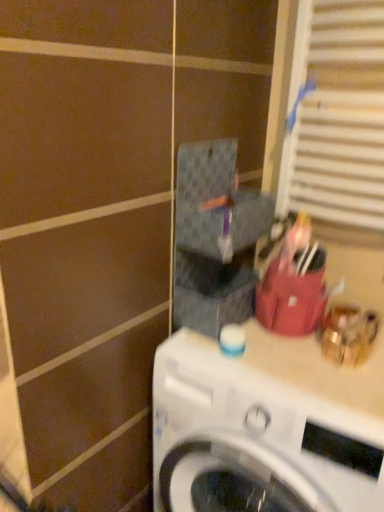
This screenshot has height=512, width=384. What do you see at coordinates (266, 426) in the screenshot?
I see `white glossy washing machine at center` at bounding box center [266, 426].

The width and height of the screenshot is (384, 512). Identify the location of white glossy washing machine at center. (266, 426).

Locate an element on the screen. white textured blinds at upper right is located at coordinates (337, 115).

What do you see at coordinates (337, 115) in the screenshot?
I see `white textured blinds at upper right` at bounding box center [337, 115].

Locate an element on the screen. The width and height of the screenshot is (384, 512). white glossy washing machine at center is located at coordinates (266, 426).

Between white textured blinds at upper right and white glossy washing machine at center, which one appears on the left side from the viewer's perspective?

Positioned to the left is white glossy washing machine at center.

Considering the positions of objects white textured blinds at upper right and white glossy washing machine at center in the image provided, who is in front, white textured blinds at upper right or white glossy washing machine at center?

white glossy washing machine at center is in front.

Which is less distant, (345, 52) or (301, 509)?

Positioned in front is point (301, 509).

From the image's perspective, which one is positioned lower, white textured blinds at upper right or white glossy washing machine at center?

From the image's view, white glossy washing machine at center is below.

From a real-world perspective, is white textured blinds at upper right above or below white glossy washing machine at center?

In terms of real-world spatial position, white textured blinds at upper right is above white glossy washing machine at center.

Which object is wider, white textured blinds at upper right or white glossy washing machine at center?

white glossy washing machine at center.

Considering the sizes of white textured blinds at upper right and white glossy washing machine at center in the image, is white textured blinds at upper right taller or shorter than white glossy washing machine at center?

white textured blinds at upper right is shorter than white glossy washing machine at center.

Between white textured blinds at upper right and white glossy washing machine at center, which one has larger size?

With larger size is white glossy washing machine at center.

Is white textured blinds at upper right situated inside white glossy washing machine at center or outside?

white textured blinds at upper right is located beyond the bounds of white glossy washing machine at center.

Is white textured blinds at upper right far from white glossy washing machine at center?

No, white textured blinds at upper right is not far away from white glossy washing machine at center.

Is white textured blinds at upper right facing towards white glossy washing machine at center?

No, white textured blinds at upper right is not aimed at white glossy washing machine at center.

Can you tell me how much white textured blinds at upper right and white glossy washing machine at center differ in facing direction?

There is a 0.0314-degree angle between the facing directions of white textured blinds at upper right and white glossy washing machine at center.

Measure the distance from white textured blinds at upper right to white glossy washing machine at center.

The distance of white textured blinds at upper right from white glossy washing machine at center is 59.33 centimeters.

Where is `washing machine lying on the left of white textured blinds at upper right`? This screenshot has height=512, width=384. washing machine lying on the left of white textured blinds at upper right is located at coordinates (266, 426).

Considering the relative positions of white glossy washing machine at center and white textured blinds at upper right in the image provided, is white glossy washing machine at center to the right of white textured blinds at upper right from the viewer's perspective?

No, white glossy washing machine at center is not to the right of white textured blinds at upper right.

Relative to white textured blinds at upper right, is white glossy washing machine at center in front or behind?

white glossy washing machine at center is positioned closer to the viewer than white textured blinds at upper right.

Which is nearer, (307, 410) or (377, 170)?

The point (307, 410) is closer.

From the image's perspective, is white glossy washing machine at center on white textured blinds at upper right?

Incorrect, from the image's perspective, white glossy washing machine at center is lower than white textured blinds at upper right.

From a real-world perspective, is white glossy washing machine at center positioned above or below white textured blinds at upper right?

white glossy washing machine at center is below white textured blinds at upper right.

Can you confirm if white glossy washing machine at center is thinner than white textured blinds at upper right?

No.

Considering the relative sizes of white glossy washing machine at center and white textured blinds at upper right in the image provided, is white glossy washing machine at center shorter than white textured blinds at upper right?

No.

Is white glossy washing machine at center bigger than white textured blinds at upper right?

Indeed, white glossy washing machine at center has a larger size compared to white textured blinds at upper right.

Would you say white glossy washing machine at center is inside or outside white textured blinds at upper right?

white glossy washing machine at center is not inside white textured blinds at upper right, it's outside.

Is white glossy washing machine at center not close to white textured blinds at upper right?

No, there isn't a large distance between white glossy washing machine at center and white textured blinds at upper right.

Could you tell me if white glossy washing machine at center is facing white textured blinds at upper right?

No, white glossy washing machine at center is not turned towards white textured blinds at upper right.

What's the angular difference between white glossy washing machine at center and white textured blinds at upper right's facing directions?

The facing directions of white glossy washing machine at center and white textured blinds at upper right are 0.0314 degrees apart.

How much distance is there between white glossy washing machine at center and white textured blinds at upper right?

white glossy washing machine at center is 59.33 centimeters away from white textured blinds at upper right.

What are the coordinates of `window located above the white glossy washing machine at center (from a real-world perspective)` in the screenshot? It's located at (337, 115).

Identify the location of window on the right of white glossy washing machine at center. (337, 115).

At what (x,y) coordinates should I click in order to perform the action: click on window above the white glossy washing machine at center (from a real-world perspective). Please return your answer as a coordinate pair (x, y). Looking at the image, I should click on (337, 115).